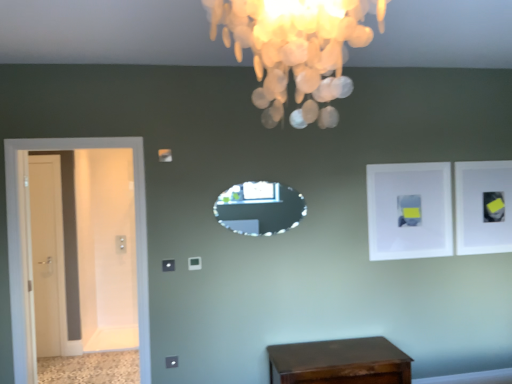
Question: From a real-world perspective, relative to ivory shell chandelier at upper center, is white matte picture frame at upper right, which is the first picture frame from back to front, vertically above or below?

Choices:
 (A) above
 (B) below

Answer: (B)

Question: Does point pos(509,218) appear closer or farther from the camera than point pos(231,34)?

Choices:
 (A) closer
 (B) farther

Answer: (B)

Question: Which of these objects is positioned farthest from the white glossy door at left, which is counted as the second door, starting from the back?

Choices:
 (A) shiny brown wooden table at lower center
 (B) white matte picture frame at upper right, which is the 2th picture frame in front-to-back order
 (C) white glossy door at left, the first door from the left
 (D) white matte picture frame at upper right, placed as the 2th picture frame when sorted from right to left
 (E) ivory shell chandelier at upper center

Answer: (B)

Question: Considering the real-world distances, which object is closest to the white glossy door at left, which is counted as the second door, starting from the back?

Choices:
 (A) white glossy door at left, acting as the first door starting from the back
 (B) white matte picture frame at upper right, placed as the second picture frame when sorted from left to right
 (C) ivory shell chandelier at upper center
 (D) crystal glass mirror at center
 (E) white matte picture frame at upper right, which is counted as the 1th picture frame, starting from the front

Answer: (D)